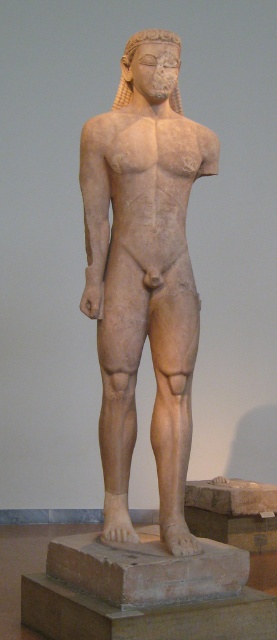
Is beige stone statue at center taller than beige stone base at center?

Correct, beige stone statue at center is much taller as beige stone base at center.

Is beige stone statue at center positioned in front of beige stone base at center?

No, it is behind beige stone base at center.

Is point (96, 132) closer to camera compared to point (214, 573)?

No, it is not.

You are a GUI agent. You are given a task and a screenshot of the screen. Output one action in this format:
    pyautogui.click(x=<x>, y=<y>)
    Task: Click on the beige stone statue at center
    The width and height of the screenshot is (277, 640).
    Given the screenshot: What is the action you would take?
    pyautogui.click(x=144, y=273)